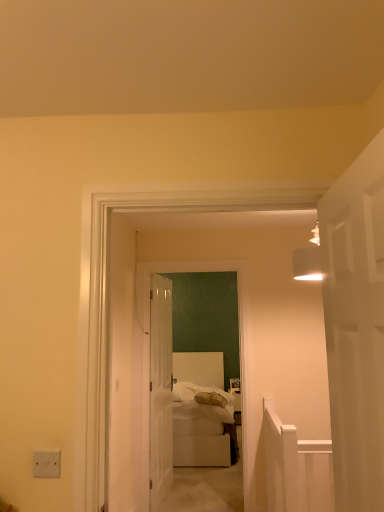
Where is `vacant point to the right of clear glass door at center, which ranks as the 1th door in left-to-right order`? This screenshot has width=384, height=512. vacant point to the right of clear glass door at center, which ranks as the 1th door in left-to-right order is located at coordinates (199, 495).